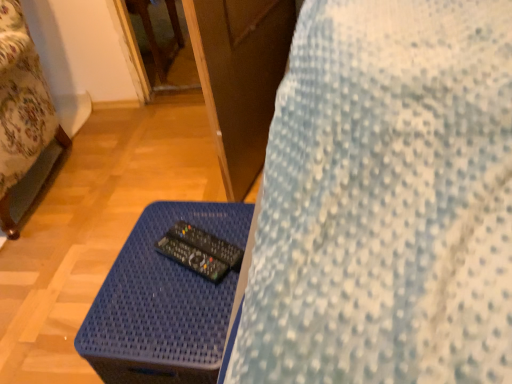
The image size is (512, 384). Find the location of `vacant area to the left of black plastic remote at center, placed as the 1th control when sorted from bottom to top`. vacant area to the left of black plastic remote at center, placed as the 1th control when sorted from bottom to top is located at coordinates (132, 281).